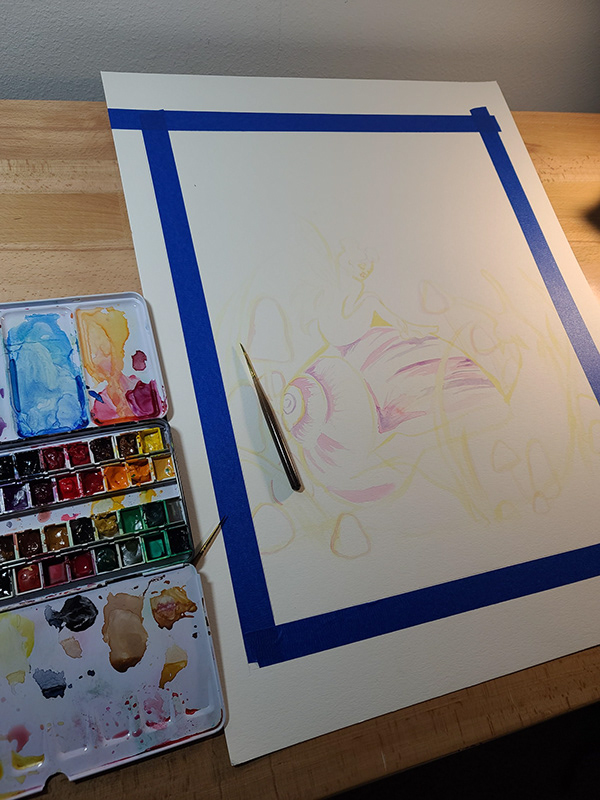
You are a GUI agent. You are given a task and a screenshot of the screen. Output one action in this format:
    pyautogui.click(x=<x>, y=<y>)
    Task: Click on the white wall
    This screenshot has width=600, height=800.
    Given the screenshot: What is the action you would take?
    pyautogui.click(x=301, y=26)